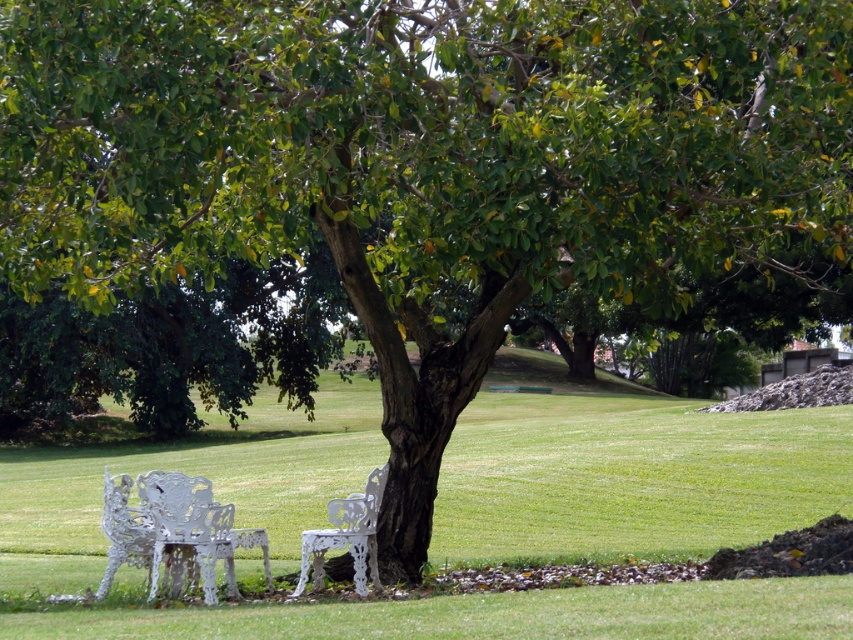
You are standing in the outdoor area and want to place a small potted plant between the two points, point 1 at point (80, 476) and point 2 at point (120, 541). Which point should you move towards to ensure the plant is closer to the front of the scene?

You should move towards point (80, 476) because it is further to the camera than point (120, 541), making it closer to the front of the scene.

You are planning to host a small gathering and need seating for four people. You have two white benches available in the scene. Which bench between the white metal bench at lower left and the white wrought iron bench at center would you choose to seat more guests comfortably?

The white metal bench at lower left might be wider than the white wrought iron bench at center, so it can accommodate more guests comfortably.